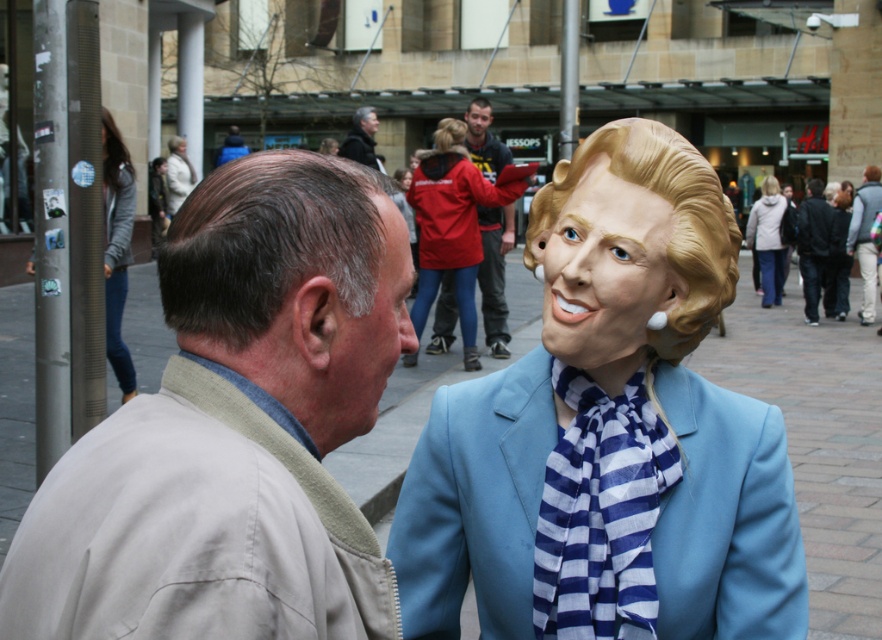
Does denim jacket at upper left have a larger size compared to matte plastic mask at center?

Indeed, denim jacket at upper left has a larger size compared to matte plastic mask at center.

Does point (131, 205) come in front of point (374, 132)?

Yes.

The width and height of the screenshot is (882, 640). Identify the location of denim jacket at upper left. (116, 244).

Between gray matte hair at upper left and dark gray jacket at center, which one appears on the right side from the viewer's perspective?

dark gray jacket at center

Who is positioned more to the left, gray matte hair at upper left or dark gray jacket at center?

Positioned to the left is gray matte hair at upper left.

This screenshot has height=640, width=882. Describe the element at coordinates (367, 336) in the screenshot. I see `gray matte hair at upper left` at that location.

Where is `gray matte hair at upper left`? The image size is (882, 640). gray matte hair at upper left is located at coordinates (367, 336).

Can you confirm if blue fabric business suit at right is positioned to the left of matte plastic mask at center?

No, blue fabric business suit at right is not to the left of matte plastic mask at center.

Which of these two, blue fabric business suit at right or matte plastic mask at center, stands shorter?

Standing shorter between the two is matte plastic mask at center.

Find the location of a particular element. The image size is (882, 640). blue fabric business suit at right is located at coordinates (475, 502).